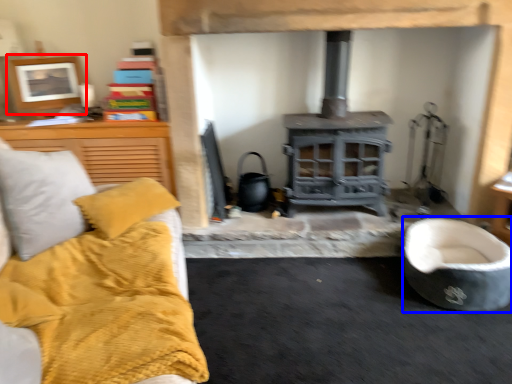
Question: Which object appears farthest to the camera in this image, picture frame (highlighted by a red box) or rocking chair (highlighted by a blue box)?

Choices:
 (A) picture frame
 (B) rocking chair

Answer: (A)